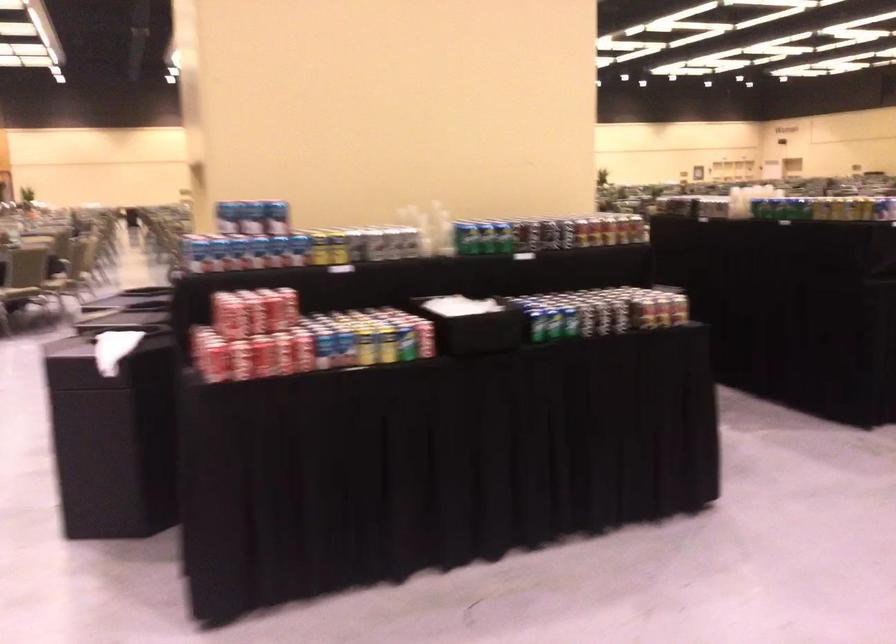
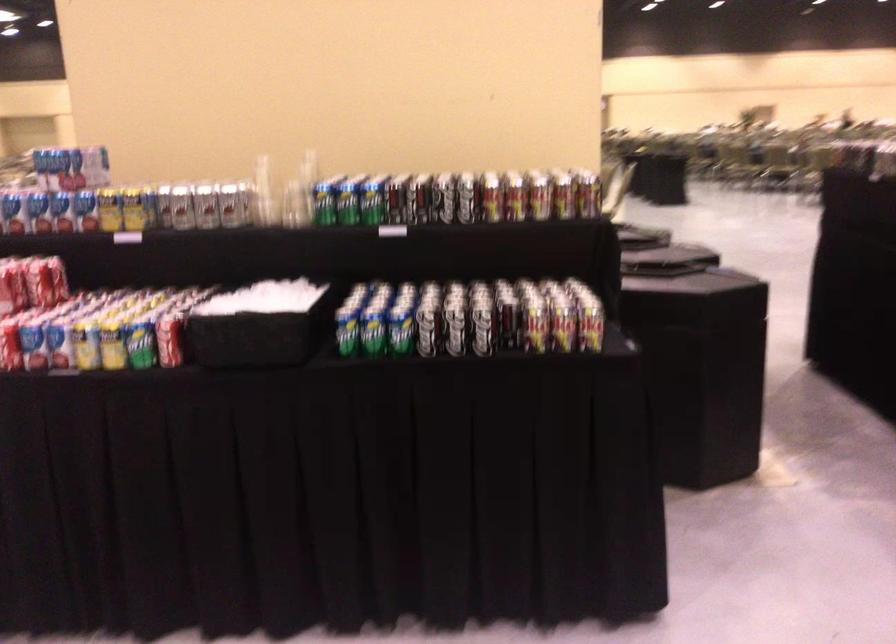
The point at (653, 308) is marked in the first image. Where is the corresponding point in the second image?

(533, 323)